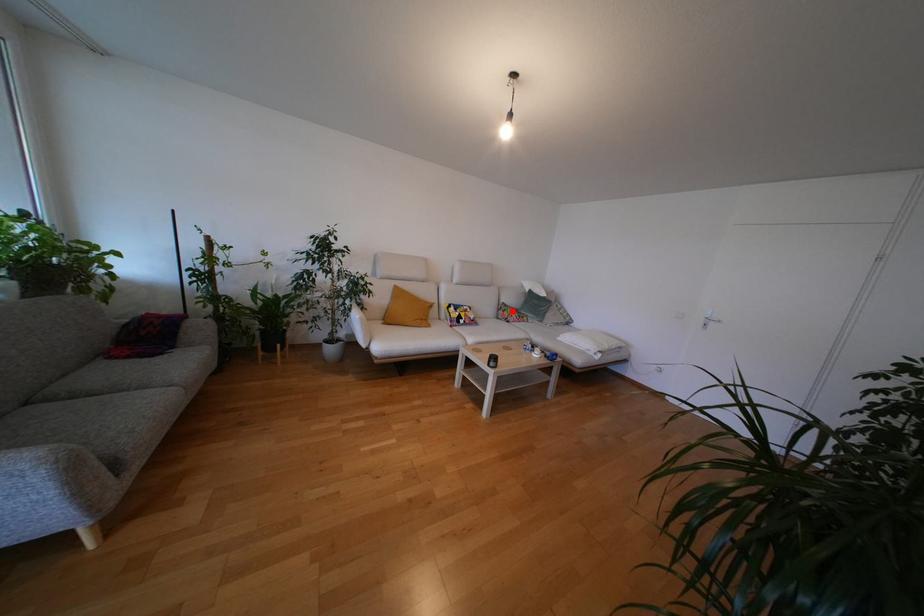
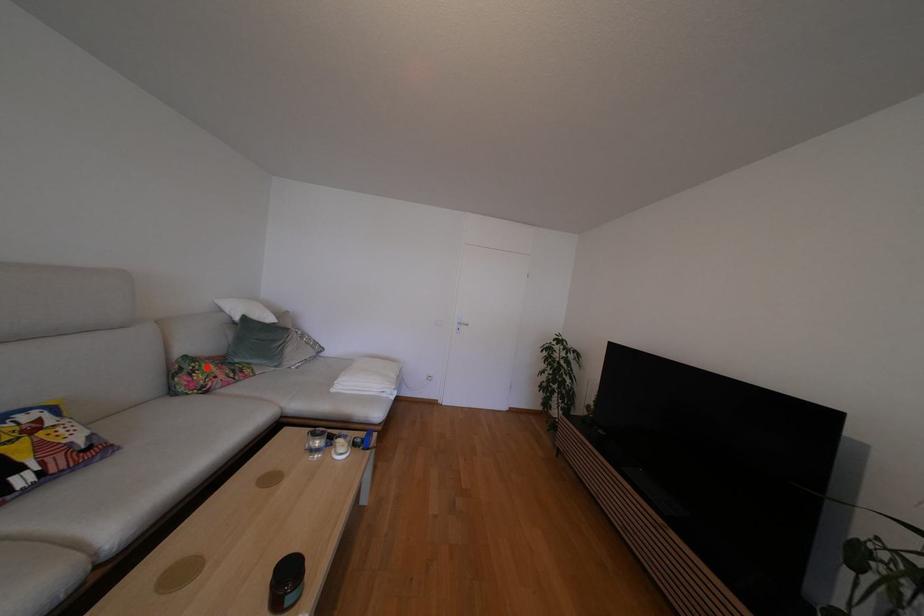
I am providing you with two images of the same scene from different viewpoints. A red point is marked on the first image and another point is marked on the second image. Do the highlighted points in image1 and image2 indicate the same real-world spot?

Yes